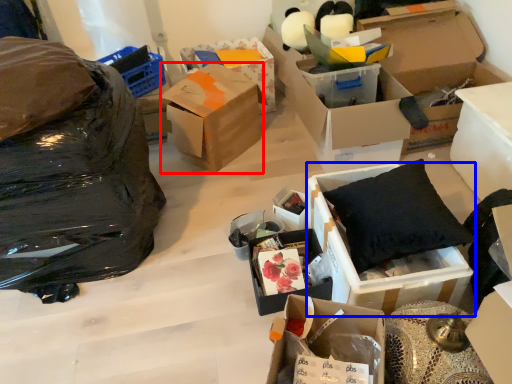
Question: Which point is closer to the camera, box (highlighted by a red box) or box (highlighted by a blue box)?

Choices:
 (A) box
 (B) box

Answer: (B)